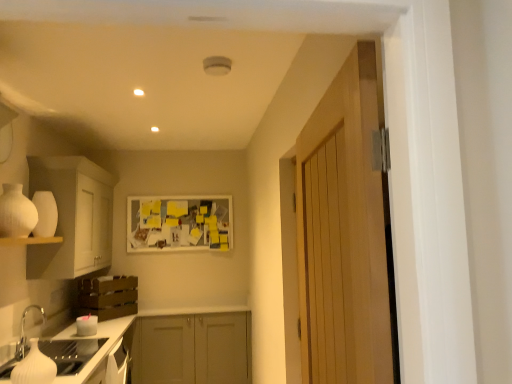
This screenshot has height=384, width=512. I want to click on free point above yellow paper at center (from a real-world perspective), so click(x=177, y=195).